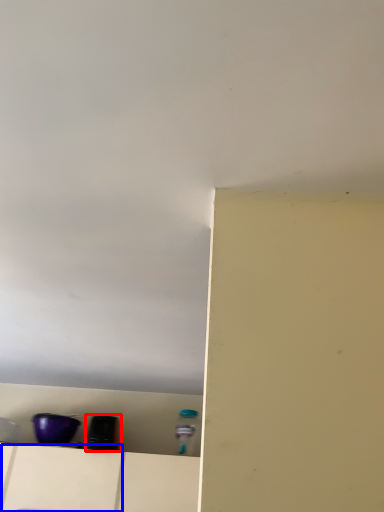
Question: Which object appears farthest to the camera in this image, appliance (highlighted by a red box) or drawer (highlighted by a blue box)?

Choices:
 (A) appliance
 (B) drawer

Answer: (A)